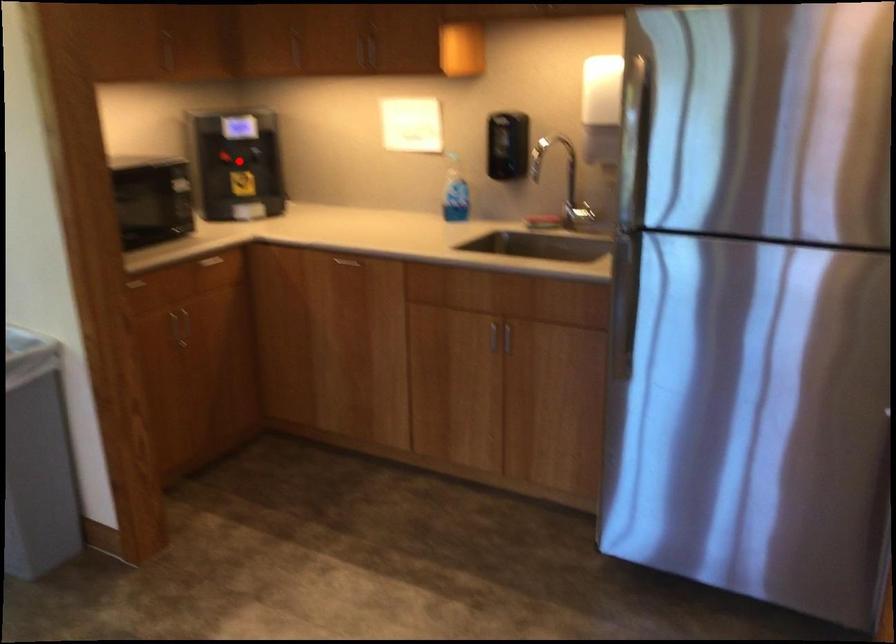
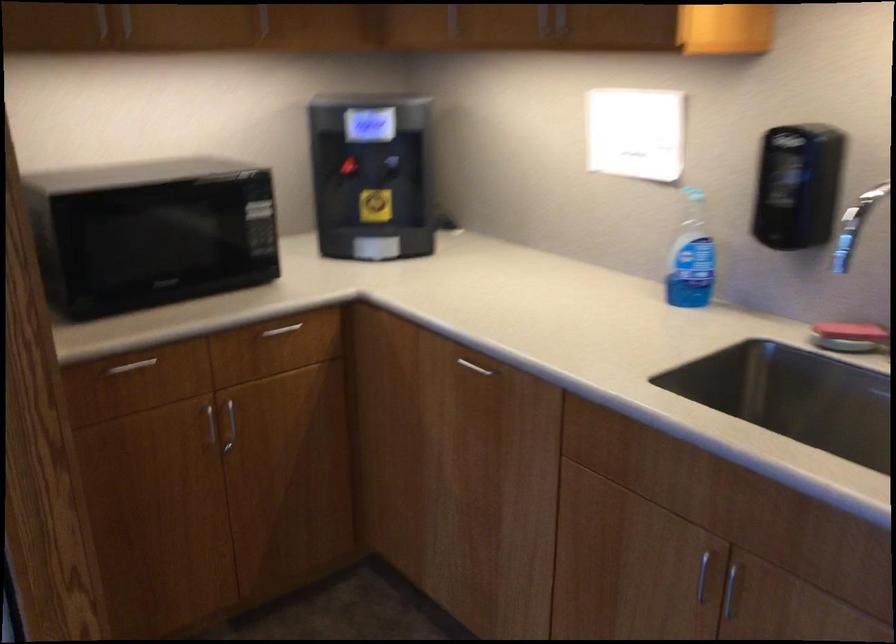
Question: I am providing you with two images of the same scene from different viewpoints. Image1 has a red point marked. In image2, the corresponding 3D location appears at what relative position? Reply with the corresponding letter.

Choices:
 (A) Closer
 (B) Farther

Answer: (A)